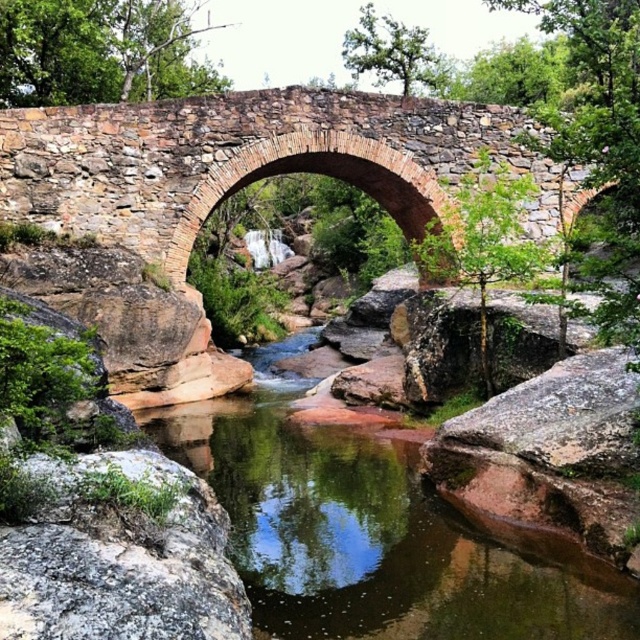
You are standing on the rustic stone bridge and want to determine which of the two points, point (106, 186) or point (22, 611), is closer to you. Based on the scene description, which point is nearer?

Point (106, 186) is further to the viewer than point (22, 611). Wait, the question asks which is closer to you. Since point (106, 186) is further away, the closer point would be point (22, 611).